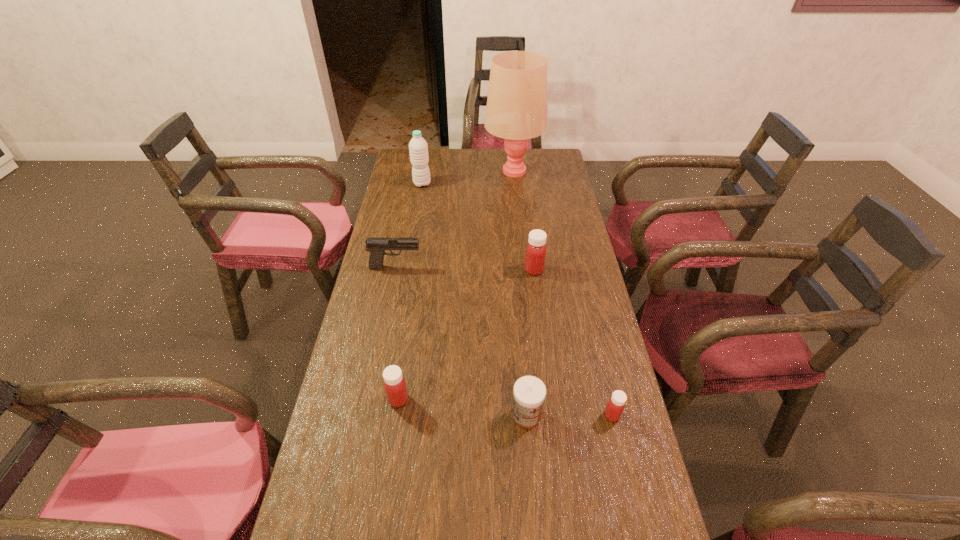
At what (x,y) coordinates should I click in order to perform the action: click on water bottle present at the left edge. Please return your answer as a coordinate pair (x, y). This screenshot has height=540, width=960. Looking at the image, I should click on (418, 148).

Where is `pistol positioned at the left edge`? The image size is (960, 540). pistol positioned at the left edge is located at coordinates (376, 246).

This screenshot has height=540, width=960. I want to click on medicine situated at the left edge, so click(x=395, y=387).

The width and height of the screenshot is (960, 540). I want to click on lampshade that is at the right edge, so click(x=516, y=110).

The width and height of the screenshot is (960, 540). I want to click on object that is positioned at the far right corner, so click(x=516, y=110).

Identify the location of free space at the far edge of the desktop. This screenshot has width=960, height=540. (457, 153).

At what (x,y) coordinates should I click in order to perform the action: click on free space at the left edge of the desktop. Please return your answer as a coordinate pair (x, y). Looking at the image, I should click on (413, 180).

Where is `vacant space at the right edge of the desktop`? vacant space at the right edge of the desktop is located at coordinates (549, 228).

The width and height of the screenshot is (960, 540). In the image, there is a desktop. In order to click on vacant space at the far left corner in this screenshot , I will do `click(411, 168)`.

Where is `vacant point at the far right corner`? The height and width of the screenshot is (540, 960). vacant point at the far right corner is located at coordinates (538, 152).